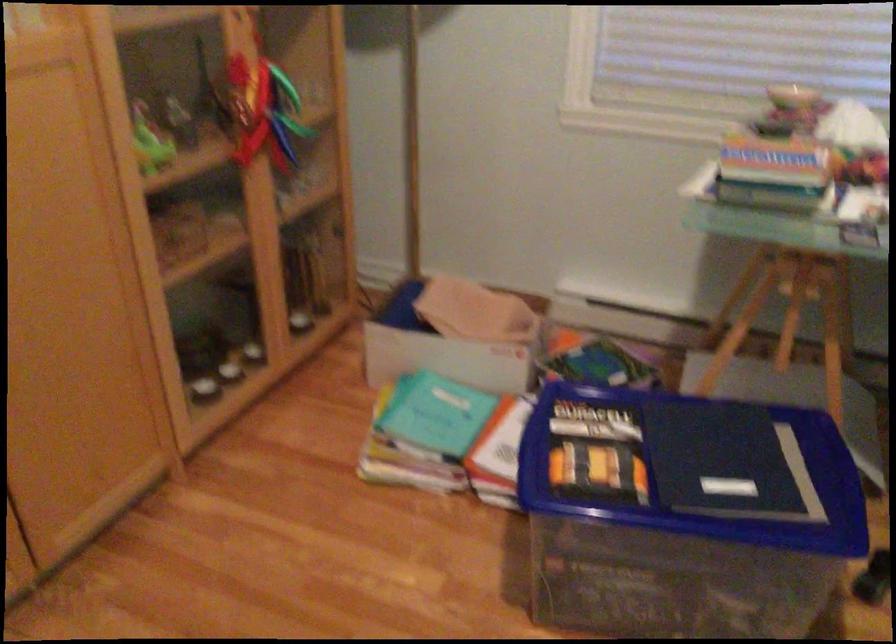
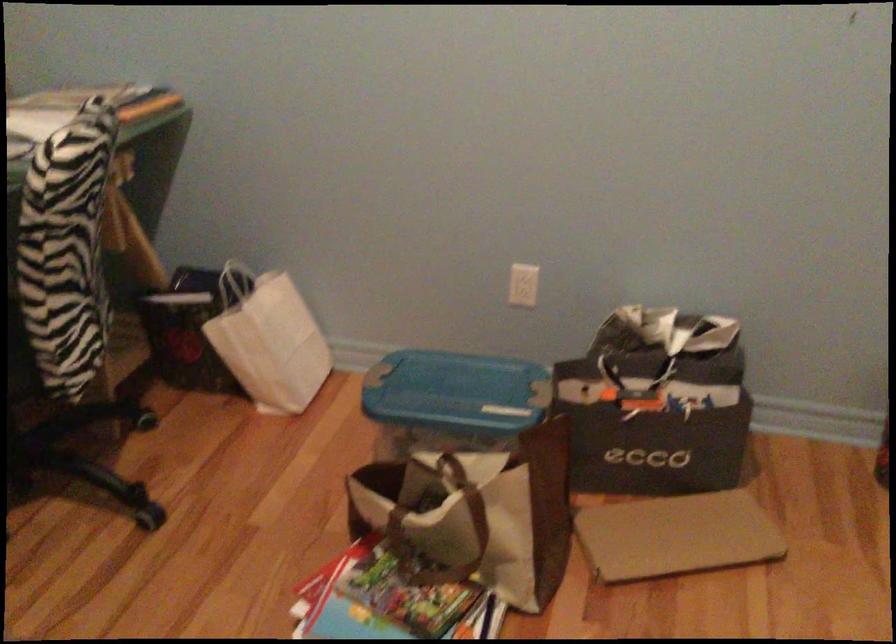
How did the camera likely rotate?

The rotation direction of the camera is right-down.